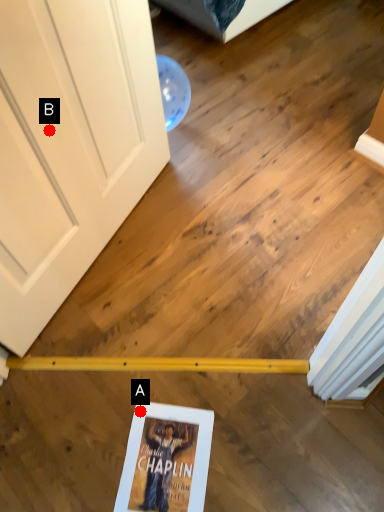
Question: Two points are circled on the image, labeled by A and B beside each circle. Among these points, which one is farthest from the camera?

Choices:
 (A) A is further
 (B) B is further

Answer: (A)